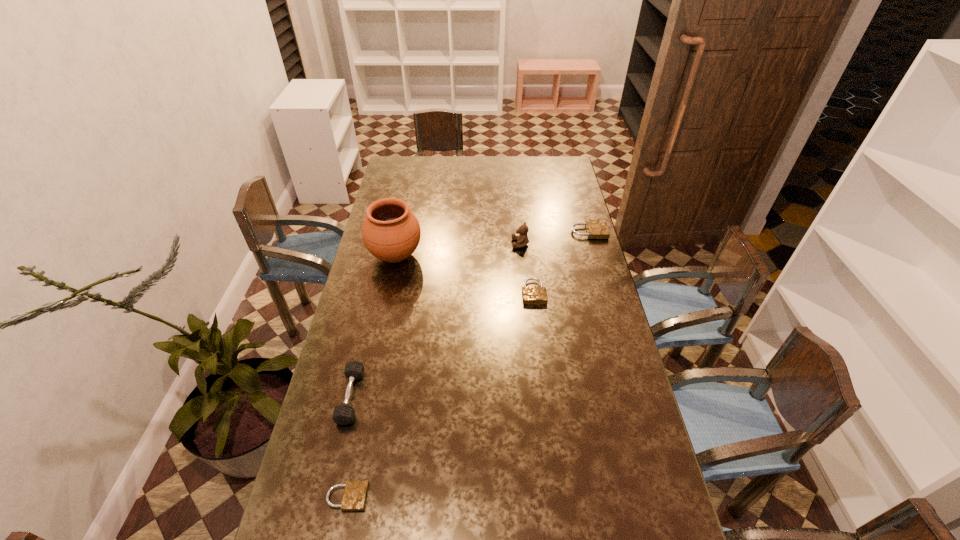
This screenshot has width=960, height=540. I want to click on vacant space in between the dumbbell and the fifth shortest object, so click(x=436, y=320).

Identify the location of free spot between the fifth farthest object and the leftmost padlock. (349, 447).

Where is `vacant area that lies between the second shortest padlock and the farthest padlock`? vacant area that lies between the second shortest padlock and the farthest padlock is located at coordinates (562, 262).

At what (x,y) coordinates should I click in order to perform the action: click on empty location between the fifth shortest object and the second tallest padlock. Please return your answer as a coordinate pair (x, y). The height and width of the screenshot is (540, 960). Looking at the image, I should click on (527, 268).

Identify the location of empty space between the second nearest object and the nearest object. (349, 447).

Find the location of `empty space that is in between the shortest object and the tallest object`. empty space that is in between the shortest object and the tallest object is located at coordinates (372, 376).

Point out which object is positioned as the fifth nearest to the fifth tallest object. Please provide its 2D coordinates. Your answer should be formatted as a tuple, i.e. [(x, y)], where the tuple contains the x and y coordinates of a point satisfying the conditions above.

[(355, 494)]

The width and height of the screenshot is (960, 540). What are the coordinates of `object that is the third closest to the nearest object` in the screenshot? It's located at (390, 232).

In order to click on padlock that is the second nearest to the fifth tallest object in this screenshot , I will do `click(355, 494)`.

You are a GUI agent. You are given a task and a screenshot of the screen. Output one action in this format:
    pyautogui.click(x=<x>, y=<y>)
    Task: Click on the padlock that is the second closest to the shortest padlock
    The height and width of the screenshot is (540, 960).
    Given the screenshot: What is the action you would take?
    point(596,229)